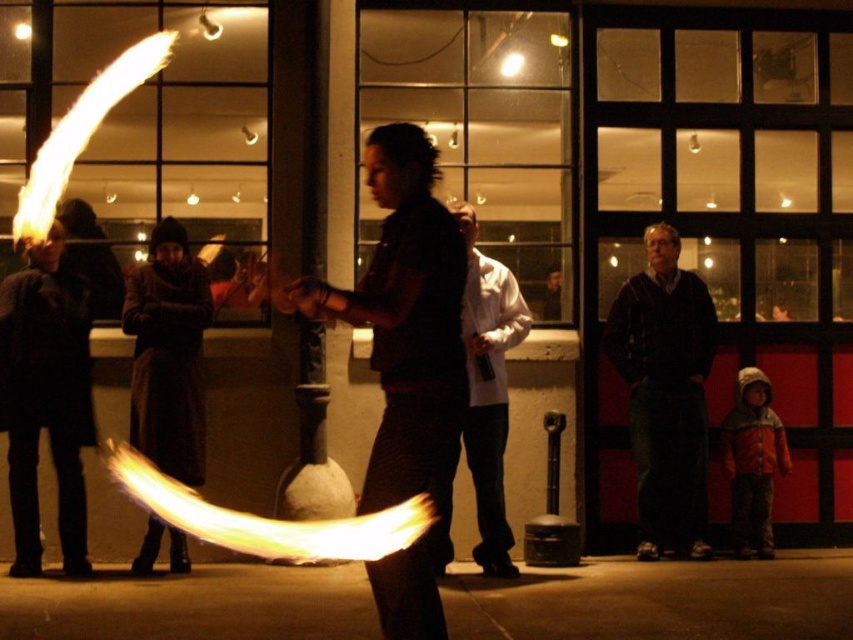
Question: Does dark woolen coat at left have a smaller size compared to dark brown coat at left?

Choices:
 (A) no
 (B) yes

Answer: (B)

Question: Which of the following is the farthest from the observer?

Choices:
 (A) dark brown coat at left
 (B) dark brown leather jacket at right
 (C) matte black shirt at center

Answer: (B)

Question: In this image, where is dark woolen coat at left located relative to white matte jacket at center?

Choices:
 (A) below
 (B) above

Answer: (A)

Question: Which object appears closest to the camera in this image?

Choices:
 (A) dark brown coat at left
 (B) dark brown leather jacket at right
 (C) dark woolen coat at left
 (D) white matte jacket at center

Answer: (D)

Question: Among these objects, which one is nearest to the camera?

Choices:
 (A) dark brown coat at left
 (B) dark woolen coat at left
 (C) white matte jacket at center
 (D) matte black shirt at center

Answer: (D)

Question: Is dark woolen coat at left behind white matte jacket at center?

Choices:
 (A) no
 (B) yes

Answer: (B)